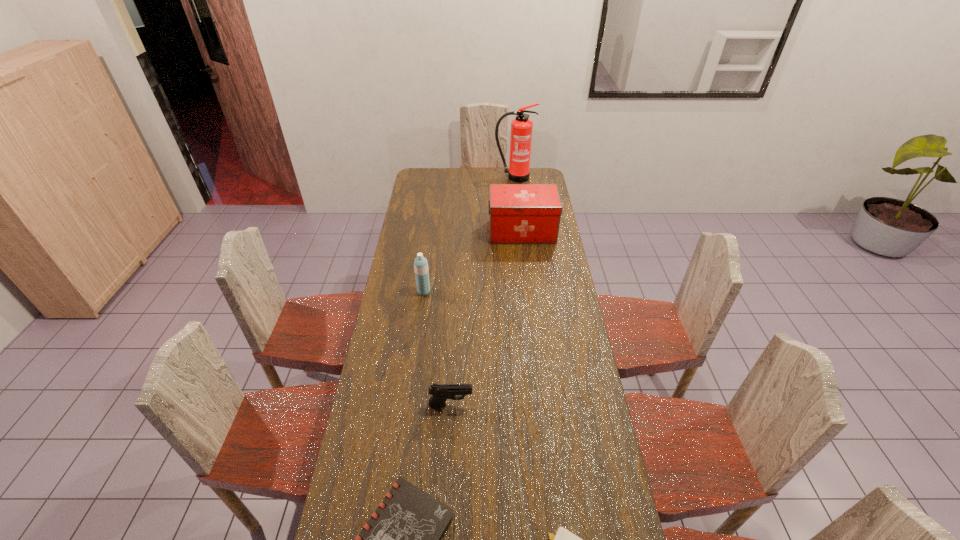
Locate an element on the screen. The height and width of the screenshot is (540, 960). fire extinguisher is located at coordinates (521, 127).

The image size is (960, 540). I want to click on the tallest object, so click(521, 127).

You are a GUI agent. You are given a task and a screenshot of the screen. Output one action in this format:
    pyautogui.click(x=<x>, y=<y>)
    Task: Click on the second farthest object
    
    Given the screenshot: What is the action you would take?
    pyautogui.click(x=518, y=213)

The width and height of the screenshot is (960, 540). In order to click on water bottle in this screenshot , I will do `click(420, 264)`.

Find the location of a particular element. The height and width of the screenshot is (540, 960). the third nearest object is located at coordinates (440, 393).

This screenshot has height=540, width=960. I want to click on pistol, so click(x=440, y=393).

Locate an element on the screen. Image resolution: width=960 pixels, height=540 pixels. vacant region located 0.150m at the nozzle of the farthest object is located at coordinates (516, 196).

This screenshot has width=960, height=540. I want to click on free space located 0.310m on the handle side of the second farthest object, so click(x=426, y=232).

What are the coordinates of `vacant space situated on the handle side of the second farthest object` in the screenshot? It's located at (429, 232).

Locate an element on the screen. free location located on the handle side of the second farthest object is located at coordinates (422, 232).